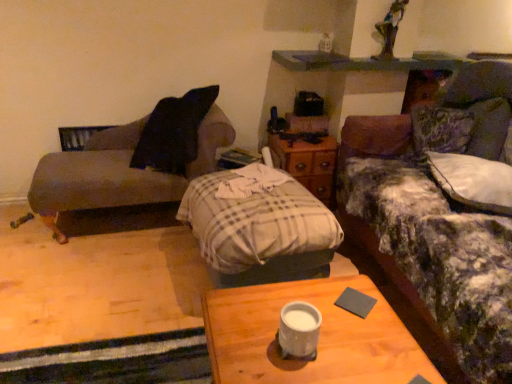
Question: Considering the relative positions of wooden desk at center and plaid fabric pillow at center in the image provided, is wooden desk at center to the left of plaid fabric pillow at center from the viewer's perspective?

Choices:
 (A) no
 (B) yes

Answer: (A)

Question: From a real-world perspective, is wooden desk at center physically below plaid fabric pillow at center?

Choices:
 (A) yes
 (B) no

Answer: (B)

Question: Is wooden desk at center turned away from plaid fabric pillow at center?

Choices:
 (A) no
 (B) yes

Answer: (A)

Question: Is wooden desk at center behind plaid fabric pillow at center?

Choices:
 (A) no
 (B) yes

Answer: (A)

Question: Is wooden desk at center to the right of plaid fabric pillow at center from the viewer's perspective?

Choices:
 (A) no
 (B) yes

Answer: (B)

Question: Is wooden desk at center located outside plaid fabric pillow at center?

Choices:
 (A) yes
 (B) no

Answer: (A)

Question: Is fluffy fabric couch at right, the 2th studio couch viewed from the left, with gray matte pad at center?

Choices:
 (A) yes
 (B) no

Answer: (B)

Question: Does fluffy fabric couch at right, marked as the 1th studio couch in a right-to-left arrangement, lie in front of gray matte pad at center?

Choices:
 (A) yes
 (B) no

Answer: (A)

Question: Is fluffy fabric couch at right, marked as the 1th studio couch in a right-to-left arrangement, looking in the opposite direction of gray matte pad at center?

Choices:
 (A) yes
 (B) no

Answer: (B)

Question: From the image's perspective, would you say fluffy fabric couch at right, the 2th studio couch viewed from the left, is positioned over gray matte pad at center?

Choices:
 (A) no
 (B) yes

Answer: (B)

Question: Is fluffy fabric couch at right, marked as the 1th studio couch in a right-to-left arrangement, positioned behind gray matte pad at center?

Choices:
 (A) no
 (B) yes

Answer: (A)

Question: Considering the relative sizes of fluffy fabric couch at right, marked as the 1th studio couch in a right-to-left arrangement, and gray matte pad at center in the image provided, is fluffy fabric couch at right, marked as the 1th studio couch in a right-to-left arrangement, shorter than gray matte pad at center?

Choices:
 (A) yes
 (B) no

Answer: (B)

Question: Considering the relative positions of plaid fabric pillow at center and gray matte pad at center in the image provided, is plaid fabric pillow at center to the left of gray matte pad at center from the viewer's perspective?

Choices:
 (A) no
 (B) yes

Answer: (B)